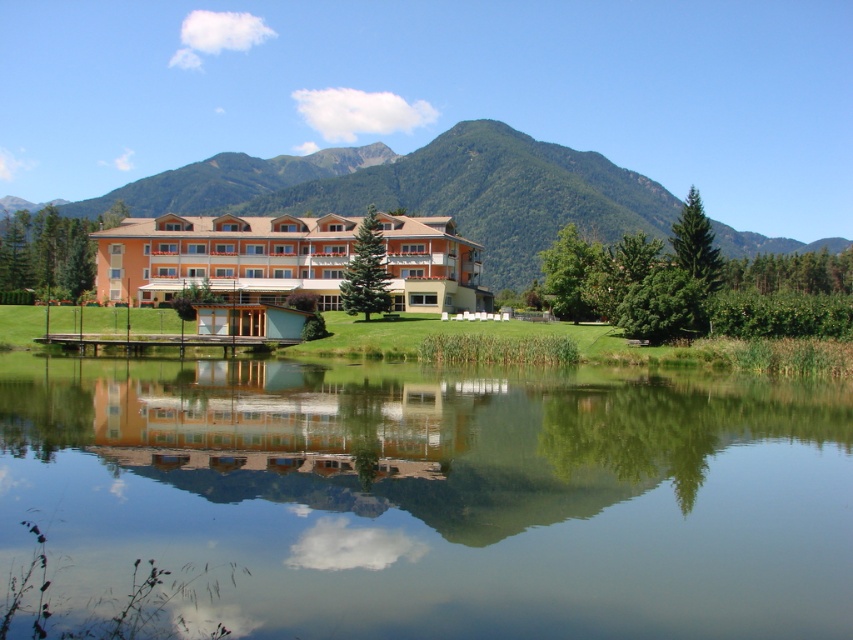
Question: Can you confirm if transparent glass water at center is positioned below green textured mountain at center?

Choices:
 (A) no
 (B) yes

Answer: (B)

Question: Is transparent glass water at center wider than orange matte building at center?

Choices:
 (A) yes
 (B) no

Answer: (B)

Question: Which of these objects is positioned closest to the transparent glass water at center?

Choices:
 (A) orange matte building at center
 (B) green textured mountain at center

Answer: (A)

Question: Which point is closer to the camera taking this photo?

Choices:
 (A) tap(167, 236)
 (B) tap(90, 198)
 (C) tap(569, 579)

Answer: (C)

Question: Is transparent glass water at center above orange matte building at center?

Choices:
 (A) no
 (B) yes

Answer: (A)

Question: Which object is the closest to the green textured mountain at center?

Choices:
 (A) transparent glass water at center
 (B) orange matte building at center

Answer: (B)